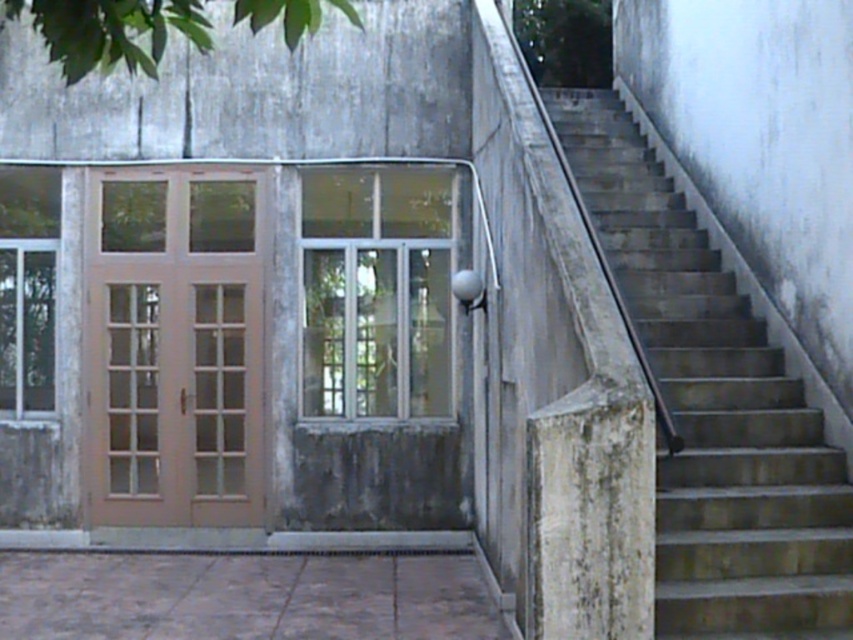
Question: Which point appears closest to the camera in this image?

Choices:
 (A) (102, 212)
 (B) (795, 611)

Answer: (B)

Question: In this image, where is concrete stairs at right located relative to light brown wood door at left?

Choices:
 (A) left
 (B) right

Answer: (B)

Question: Which point is farther to the camera?

Choices:
 (A) concrete stairs at right
 (B) light brown wood door at left

Answer: (B)

Question: Is the position of concrete stairs at right more distant than that of light brown wood door at left?

Choices:
 (A) yes
 (B) no

Answer: (B)

Question: Is the position of concrete stairs at right less distant than that of light brown wood door at left?

Choices:
 (A) no
 (B) yes

Answer: (B)